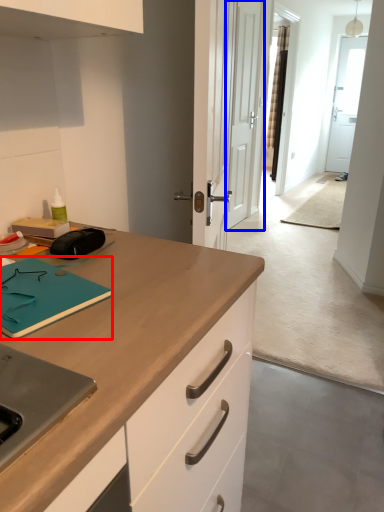
Question: Among these objects, which one is farthest to the camera, notepad (highlighted by a red box) or door (highlighted by a blue box)?

Choices:
 (A) notepad
 (B) door

Answer: (B)